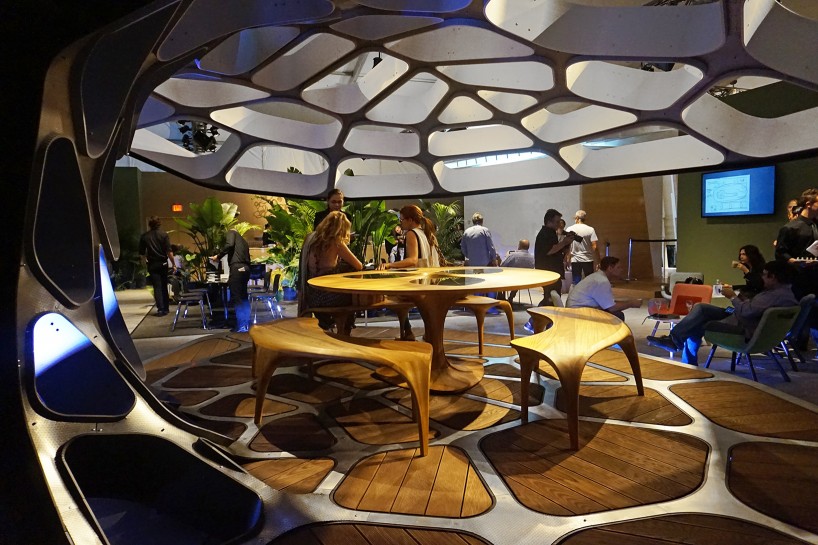
Where is `gray wall on right`? The image size is (818, 545). gray wall on right is located at coordinates (730, 235), (693, 250).